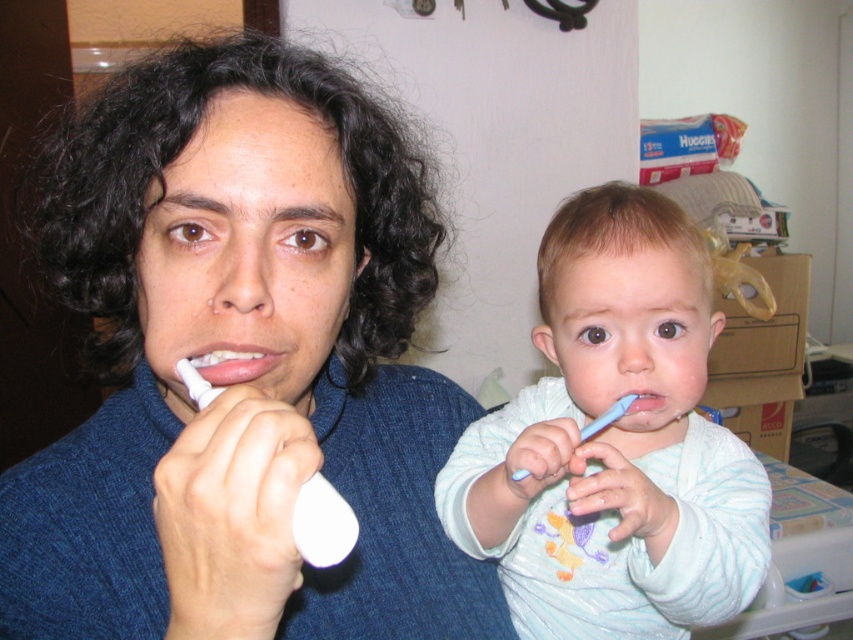
Question: Where is matte blue sweater at center located in relation to blue plastic toothbrush at center in the image?

Choices:
 (A) right
 (B) left

Answer: (B)

Question: Can you confirm if white soft toothbrush at right is thinner than matte white toothbrush at center?

Choices:
 (A) no
 (B) yes

Answer: (A)

Question: Which object is closer to the camera taking this photo?

Choices:
 (A) matte blue sweater at center
 (B) pink matte toothbrush at center

Answer: (A)

Question: Does white plastic toothbrush at left have a lesser width compared to matte white toothbrush at center?

Choices:
 (A) no
 (B) yes

Answer: (A)

Question: Which point is closer to the camera taking this photo?

Choices:
 (A) (631, 394)
 (B) (704, 317)
 (C) (173, 116)
 (D) (198, 355)

Answer: (C)

Question: Which point is farther from the camera taking this photo?

Choices:
 (A) (654, 396)
 (B) (257, 161)
 (C) (584, 428)

Answer: (A)